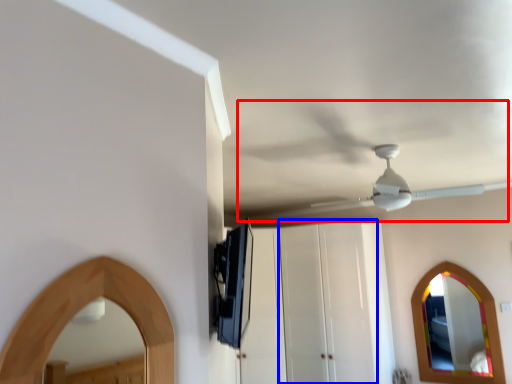
Question: Which object appears closest to the camera in this image, fan (highlighted by a red box) or glass door (highlighted by a blue box)?

Choices:
 (A) fan
 (B) glass door

Answer: (A)